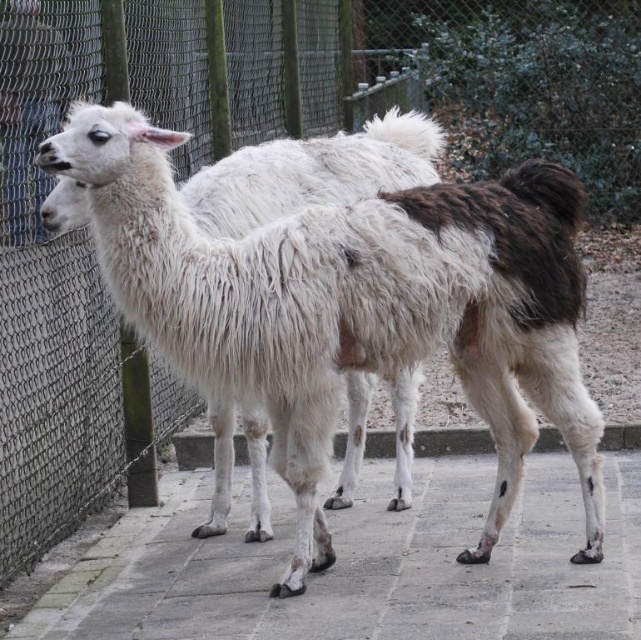
Question: Which point is closer to the camera?

Choices:
 (A) gray concrete pavement at center
 (B) white woolly alpaca at center

Answer: (B)

Question: Is white woolly alpaca at center above gray concrete pavement at center?

Choices:
 (A) yes
 (B) no

Answer: (A)

Question: Among these objects, which one is nearest to the camera?

Choices:
 (A) gray concrete pavement at center
 (B) white woolly alpaca at center

Answer: (B)

Question: In this image, where is white woolly alpaca at center located relative to gray concrete pavement at center?

Choices:
 (A) below
 (B) above

Answer: (B)

Question: Observing the image, what is the correct spatial positioning of white woolly alpaca at center in reference to gray concrete pavement at center?

Choices:
 (A) left
 (B) right

Answer: (A)